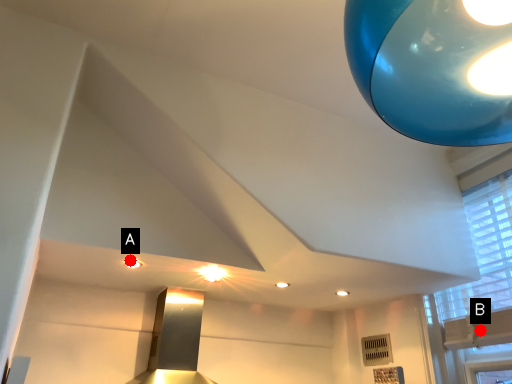
Question: Two points are circled on the image, labeled by A and B beside each circle. Which point is farther to the camera?

Choices:
 (A) A is further
 (B) B is further

Answer: (B)